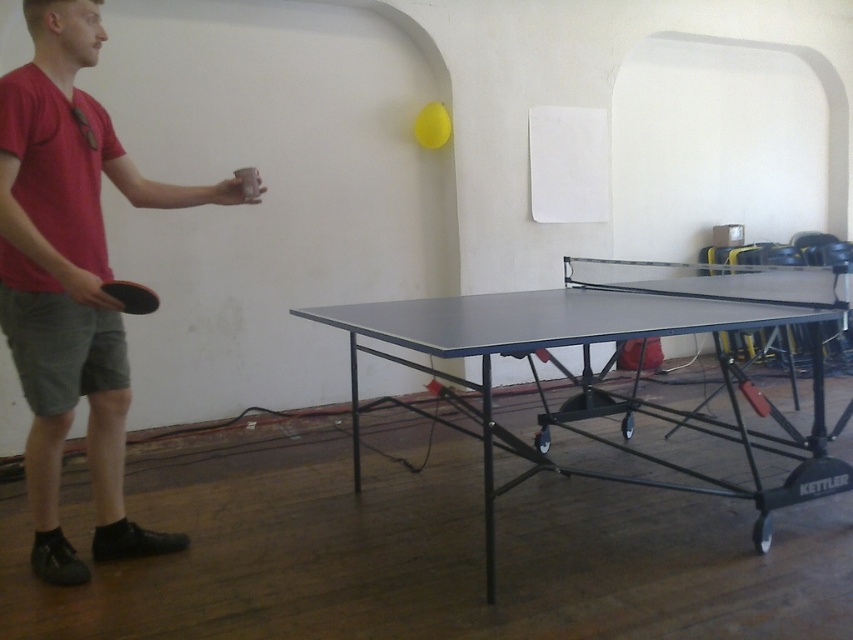
Question: Which point is closer to the camera?

Choices:
 (A) (53, 227)
 (B) (100, 289)

Answer: (B)

Question: Is matte red ping pong paddle at left below matte black ping pong table at center?

Choices:
 (A) no
 (B) yes

Answer: (A)

Question: Is matte black ping pong table at center above black rubber paddle at left?

Choices:
 (A) no
 (B) yes

Answer: (A)

Question: Which of these objects is positioned farthest from the matte black ping pong table at center?

Choices:
 (A) matte red ping pong paddle at left
 (B) black rubber paddle at left

Answer: (B)

Question: Which point is farther from the camera taking this photo?

Choices:
 (A) (112, 292)
 (B) (39, 467)
 (C) (780, 317)

Answer: (B)

Question: Does matte red ping pong paddle at left appear on the right side of matte black ping pong table at center?

Choices:
 (A) yes
 (B) no

Answer: (B)